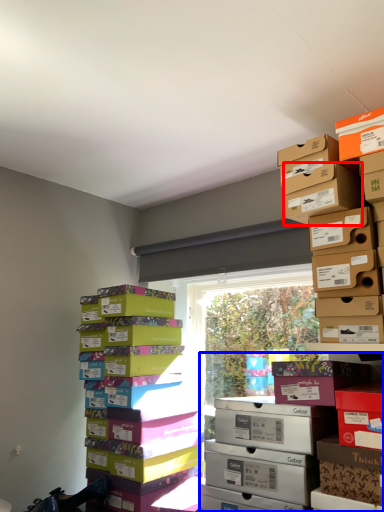
Question: Which of the following is the farthest to the observer, cardboard box (highlighted by a red box) or shelf (highlighted by a blue box)?

Choices:
 (A) cardboard box
 (B) shelf

Answer: (A)